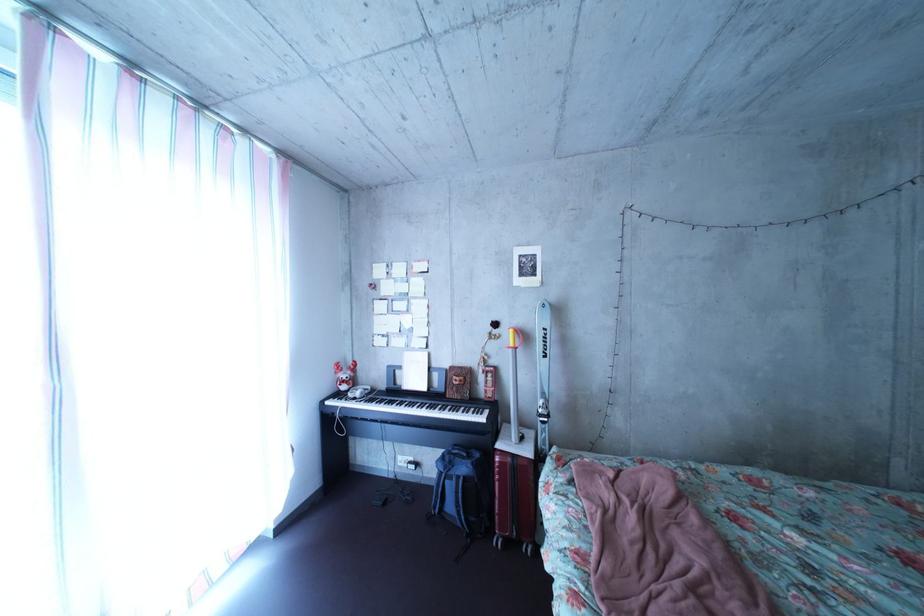
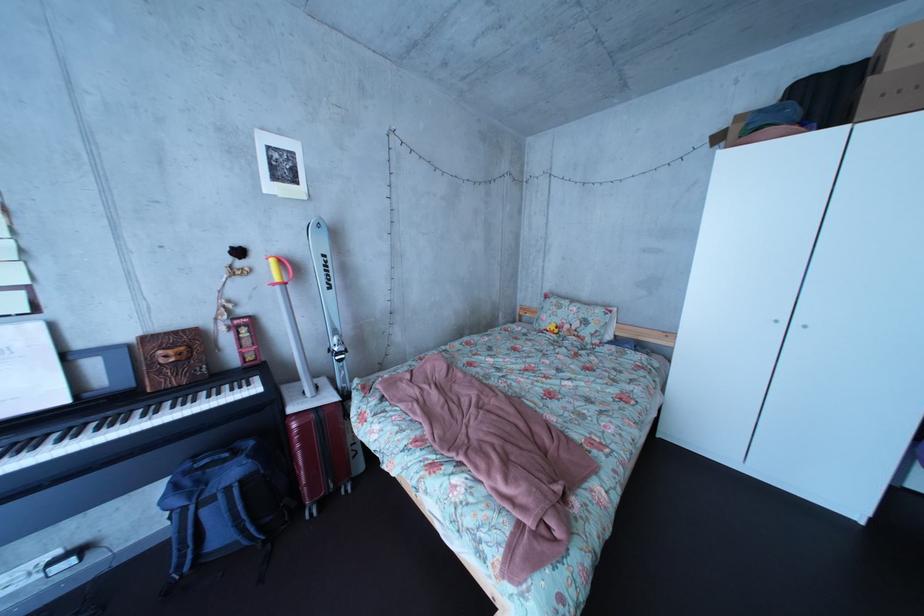
Question: The camera is either moving clockwise (left) or counter-clockwise (right) around the object. The first image is from the beginning of the video and the second image is from the end. Is the camera moving left or right when shooting the video?

Choices:
 (A) Left
 (B) Right

Answer: (A)